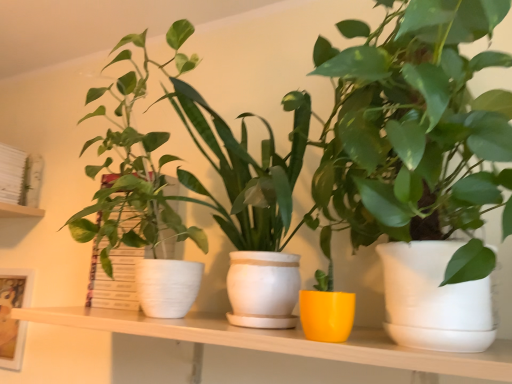
Question: Relative to matte white picture frame at left, is matte white pot at left, which is the 3th houseplant in right-to-left order, in front or behind?

Choices:
 (A) behind
 (B) front

Answer: (B)

Question: Considering the positions of matte white pot at left, which is the 3th houseplant in right-to-left order, and matte white picture frame at left in the image, is matte white pot at left, which is the 3th houseplant in right-to-left order, wider or thinner than matte white picture frame at left?

Choices:
 (A) wide
 (B) thin

Answer: (A)

Question: Which object is positioned farthest from the matte white pot at center, placed as the third houseplant when sorted from left to right?

Choices:
 (A) matte white shelf at center
 (B) matte white pot at left, which is the 3th houseplant in right-to-left order
 (C) matte white picture frame at left
 (D) yellow matte pot at center, positioned as the second houseplant in left-to-right order
 (E) white matte bookshelf at upper left

Answer: (E)

Question: Estimate the real-world distances between objects in this image. Which object is farther from the matte white pot at left, which is the 3th houseplant in right-to-left order?

Choices:
 (A) yellow matte pot at center, positioned as the second houseplant in left-to-right order
 (B) matte white picture frame at left
 (C) white matte bookshelf at upper left
 (D) matte white pot at center, which is the first houseplant from right to left
 (E) matte white shelf at center

Answer: (B)